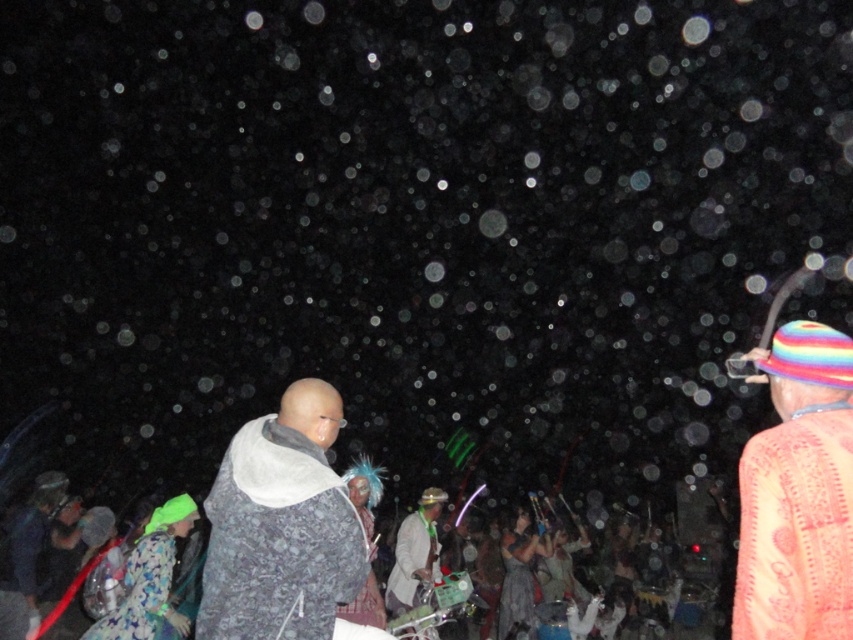
You are standing in the center of the scene and want to hand a gift to the person wearing the multicolored fabric hat at right. According to the spatial arrangement, in which direction should you move to reach them?

The multicolored fabric hat at right is located at point 0.772 on the x and 0.937 on the y, so you should move towards the right and slightly upwards to reach the person wearing it.